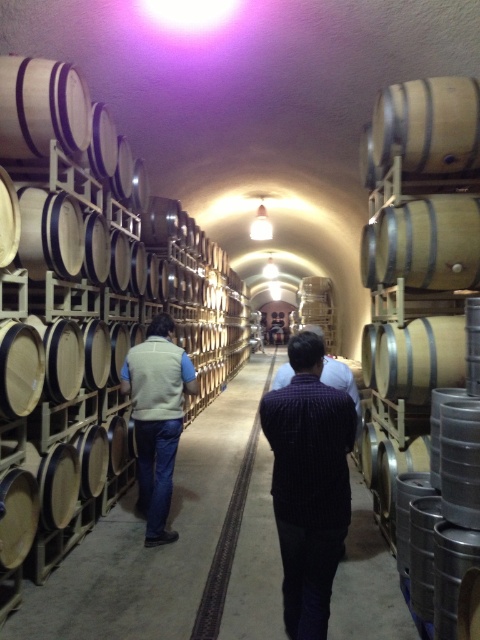
You are a tour guide leading a group through the wine cellar. You notice the natural wood barrel at right and the dark striped shirt at center. Which object is bigger in size?

The natural wood barrel at right is larger in size than the dark striped shirt at center.

You are navigating a wine cellar and need to move from one point to another. You start at point A, which is at coordinates point (104, 308), and want to reach point B at coordinates point (334, 397). Given the layout of the cellar with narrow passageways between the barrel racks, can you safely walk directly from point A to point B without encountering any obstacles?

Point (104, 308) is behind point (334, 397), so you can safely walk directly from point A to point B without encountering obstacles because there are no objects blocking the path between them in the narrow passageway.